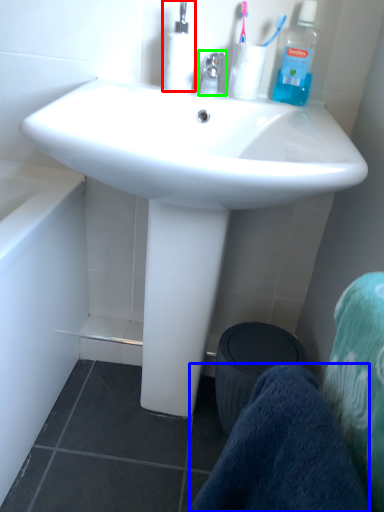
Question: Which object is the farthest from bottle (highlighted by a red box)? Choose among these: towel/napkin (highlighted by a blue box) or faucet (highlighted by a green box).

Choices:
 (A) towel/napkin
 (B) faucet

Answer: (A)